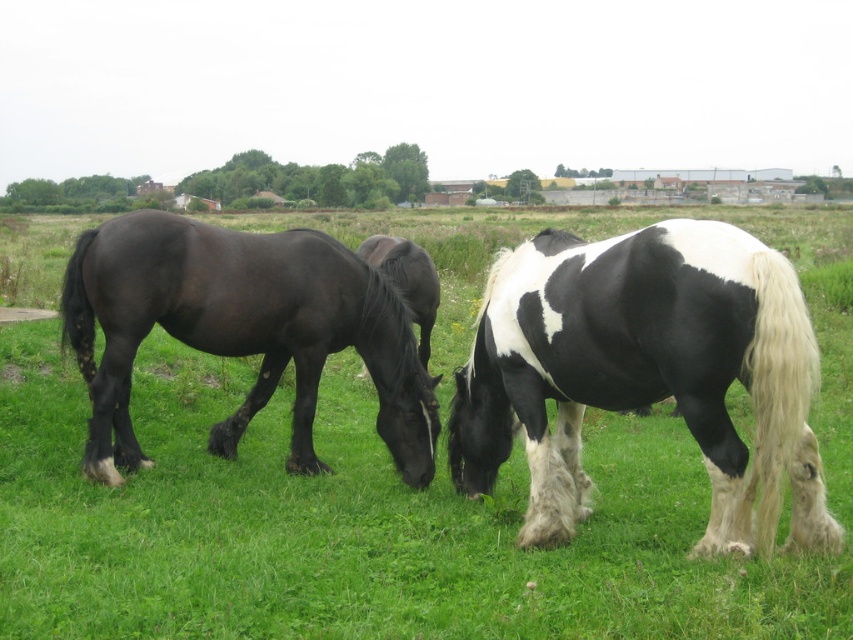
Who is taller, green grass at center or black and white speckled coat at center?

green grass at center is taller.

Describe the element at coordinates (392, 490) in the screenshot. Image resolution: width=853 pixels, height=640 pixels. I see `green grass at center` at that location.

This screenshot has height=640, width=853. What are the coordinates of `green grass at center` in the screenshot? It's located at (392, 490).

Which is behind, point (576, 582) or point (163, 212)?

Point (163, 212)

Is green grass at center wider than shiny black horse at left?

Correct, the width of green grass at center exceeds that of shiny black horse at left.

This screenshot has height=640, width=853. I want to click on green grass at center, so click(392, 490).

Identify the location of green grass at center. (392, 490).

Based on the photo, is shiny black horse at left bigger than shiny black horse at center?

Incorrect, shiny black horse at left is not larger than shiny black horse at center.

Is the position of shiny black horse at left less distant than that of shiny black horse at center?

Yes, it is.

You are a GUI agent. You are given a task and a screenshot of the screen. Output one action in this format:
    pyautogui.click(x=<x>, y=<y>)
    Task: Click on the shiny black horse at left
    The height and width of the screenshot is (640, 853).
    Given the screenshot: What is the action you would take?
    pyautogui.click(x=241, y=330)

Identify the location of shiny black horse at left. (241, 330).